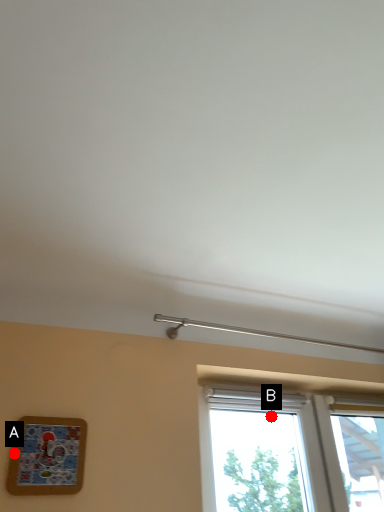
Question: Two points are circled on the image, labeled by A and B beside each circle. Which point is closer to the camera taking this photo?

Choices:
 (A) A is closer
 (B) B is closer

Answer: (A)